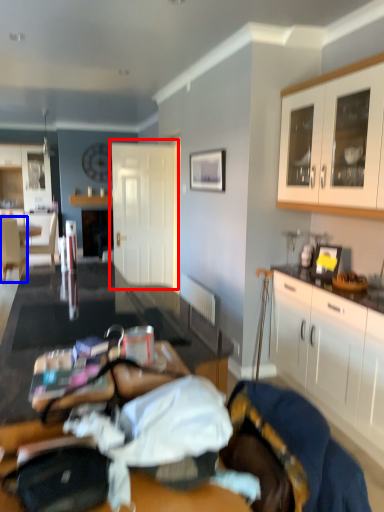
Question: Which object appears farthest to the camera in this image, door (highlighted by a red box) or chair (highlighted by a blue box)?

Choices:
 (A) door
 (B) chair

Answer: (B)